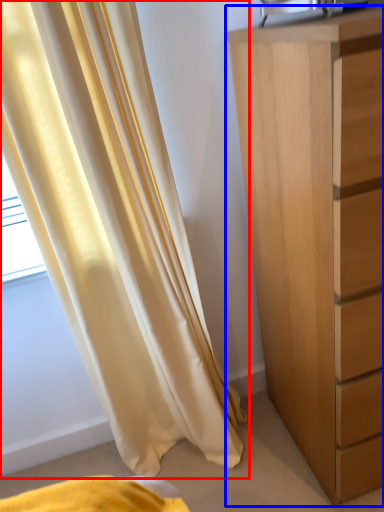
Question: Among these objects, which one is nearest to the camera, curtain (highlighted by a red box) or chest of drawers (highlighted by a blue box)?

Choices:
 (A) curtain
 (B) chest of drawers

Answer: (B)